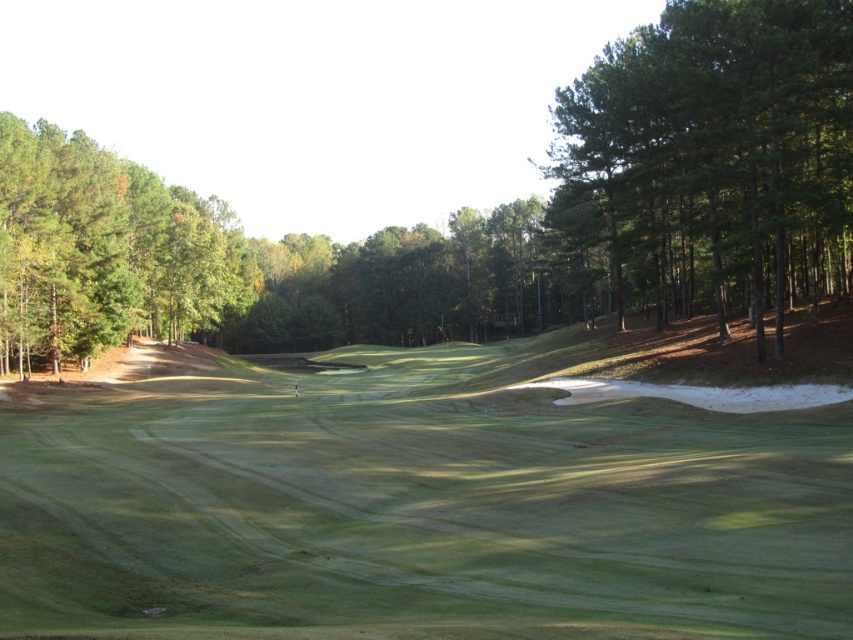
Is point (782, 592) closer to viewer compared to point (99, 288)?

Yes.

Does green grassy golf course at center have a smaller size compared to green leafy tree at left?

Yes, green grassy golf course at center is smaller than green leafy tree at left.

Between point (480, 460) and point (154, 298), which one is positioned behind?

Positioned behind is point (154, 298).

Identify the location of green grassy golf course at center. (419, 506).

Does green grassy golf course at center have a lesser width compared to green leafy trees at right?

Indeed, green grassy golf course at center has a lesser width compared to green leafy trees at right.

Where is `green grassy golf course at center`? Image resolution: width=853 pixels, height=640 pixels. green grassy golf course at center is located at coordinates (419, 506).

Does green leafy trees at right appear on the left side of green leafy tree at left?

No, green leafy trees at right is not to the left of green leafy tree at left.

Does green leafy trees at right come behind green leafy tree at left?

No, green leafy trees at right is closer to the viewer.

You are a GUI agent. You are given a task and a screenshot of the screen. Output one action in this format:
    pyautogui.click(x=<x>, y=<y>)
    Task: Click on the green leafy trees at right
    This screenshot has height=640, width=853.
    Given the screenshot: What is the action you would take?
    pyautogui.click(x=712, y=154)